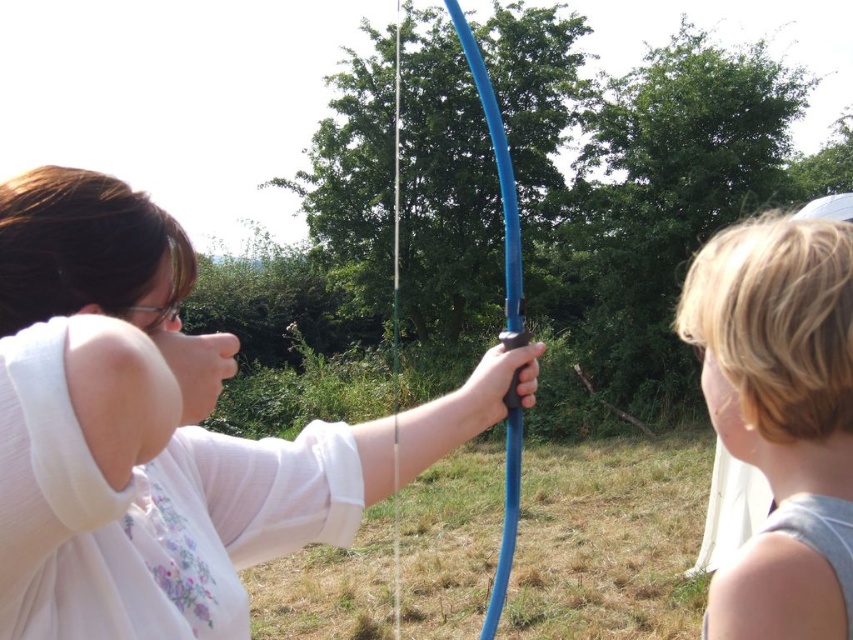
Who is lower down, matte white shirt at center or blonde hair at right?

Positioned lower is matte white shirt at center.

Who is higher up, matte white shirt at center or blonde hair at right?

blonde hair at right is above.

Is point (177, 243) more distant than point (848, 332)?

Yes, it is.

Locate an element on the screen. Image resolution: width=853 pixels, height=640 pixels. matte white shirt at center is located at coordinates 149,406.

Is matte white shirt at center to the right of blue rubber hose at center from the viewer's perspective?

Incorrect, matte white shirt at center is not on the right side of blue rubber hose at center.

From the picture: Can you confirm if matte white shirt at center is shorter than blue rubber hose at center?

Yes.

Measure the distance between matte white shirt at center and camera.

The distance of matte white shirt at center from camera is 16.65 inches.

Locate an element on the screen. Image resolution: width=853 pixels, height=640 pixels. matte white shirt at center is located at coordinates (149, 406).

Is blonde hair at right closer to camera compared to blue rubber hose at center?

Yes.

Does blonde hair at right have a greater width compared to blue rubber hose at center?

Incorrect, blonde hair at right's width does not surpass blue rubber hose at center's.

Who is more distant from viewer, (820,385) or (508,561)?

Point (508,561)

Locate an element on the screen. blonde hair at right is located at coordinates (781, 417).